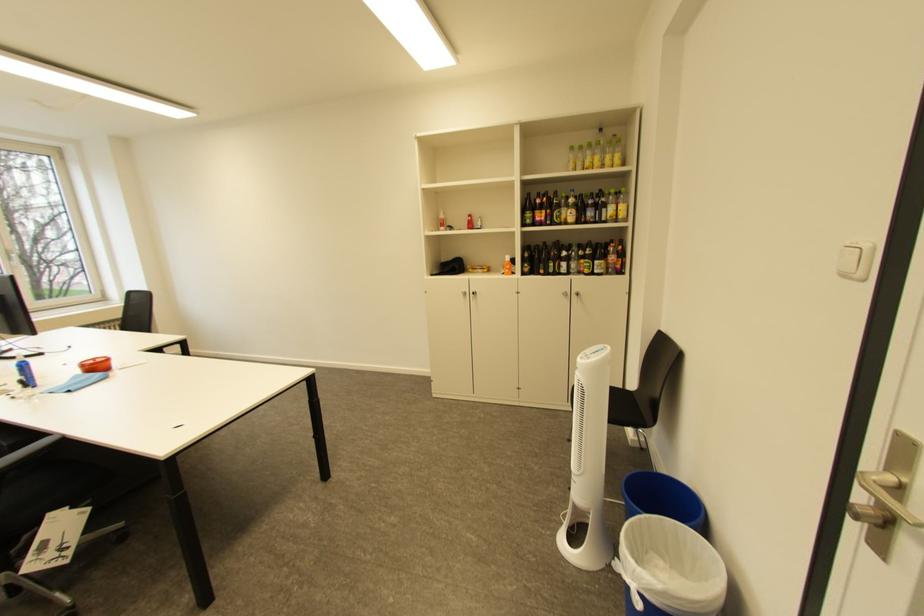
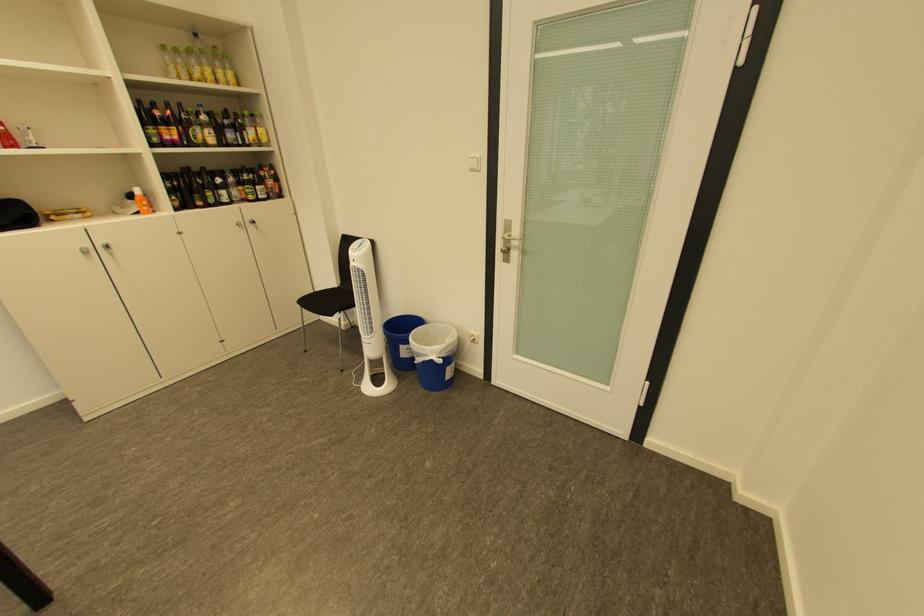
The point at (606, 159) is marked in the first image. Where is the corresponding point in the second image?

(217, 71)